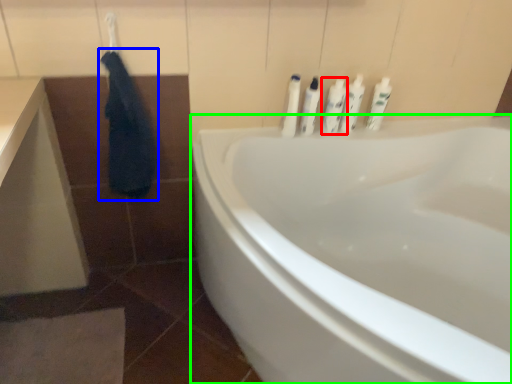
Question: Which object is the farthest from toiletry (highlighted by a red box)? Choose among these: robe (highlighted by a blue box) or bathtub (highlighted by a green box).

Choices:
 (A) robe
 (B) bathtub

Answer: (A)